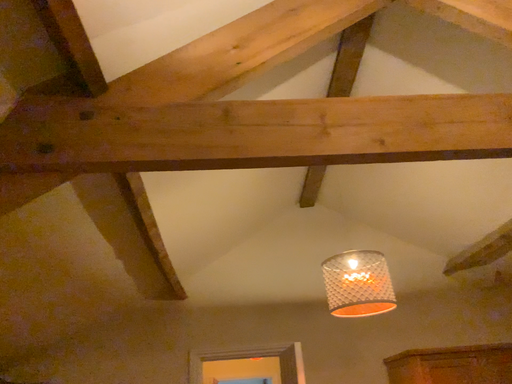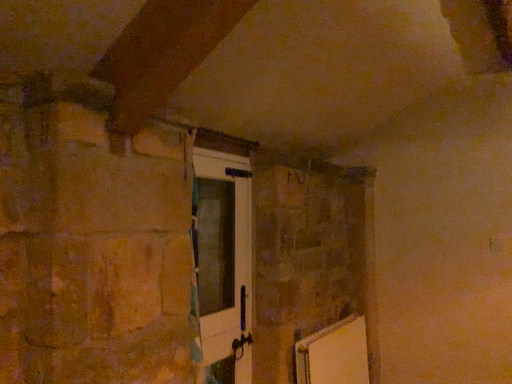
Question: Which way did the camera rotate in the video?

Choices:
 (A) rotated downward
 (B) rotated upward

Answer: (A)